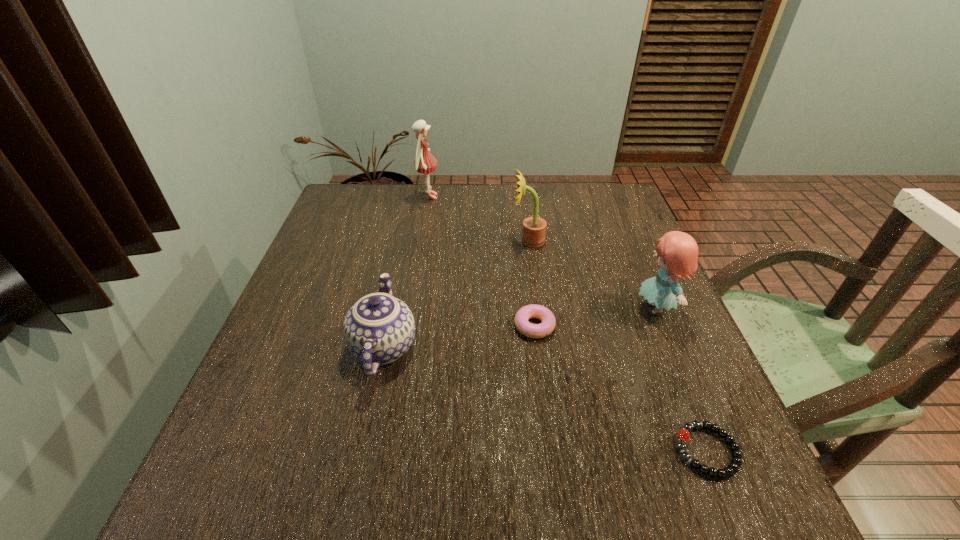
The image size is (960, 540). In order to click on the farther doll in this screenshot , I will do `click(424, 162)`.

You are a GUI agent. You are given a task and a screenshot of the screen. Output one action in this format:
    pyautogui.click(x=<x>, y=<y>)
    Task: Click on the left doll
    This screenshot has width=960, height=540.
    Given the screenshot: What is the action you would take?
    pyautogui.click(x=424, y=162)

This screenshot has height=540, width=960. Identify the location of the second farthest object. (534, 228).

Find the location of a particular element. The height and width of the screenshot is (540, 960). the nearer doll is located at coordinates (677, 252).

At what (x,y) coordinates should I click in order to perform the action: click on the right doll. Please return your answer as a coordinate pair (x, y). The width and height of the screenshot is (960, 540). Looking at the image, I should click on (677, 252).

The image size is (960, 540). I want to click on the fourth tallest object, so click(x=378, y=329).

I want to click on doughnut, so click(530, 330).

Where is `the shortest object`? This screenshot has height=540, width=960. the shortest object is located at coordinates (683, 435).

The height and width of the screenshot is (540, 960). I want to click on bracelet, so click(683, 435).

This screenshot has height=540, width=960. Identify the location of free space located 0.370m on the front-facing side of the farther doll. (557, 197).